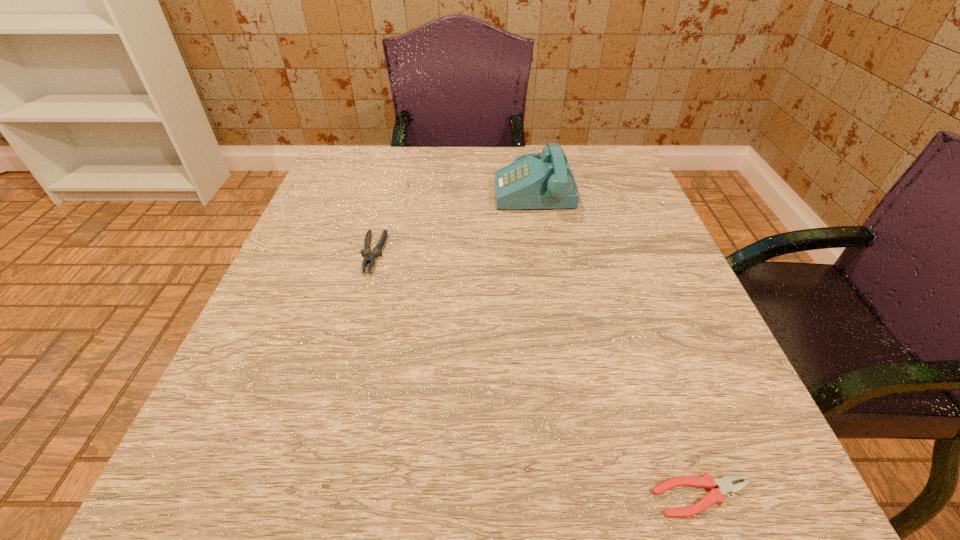
This screenshot has height=540, width=960. What are the coordinates of `telephone` in the screenshot? It's located at click(x=528, y=183).

Where is `the farthest object`? The width and height of the screenshot is (960, 540). the farthest object is located at coordinates (528, 183).

Identify the location of the farther pliers. (370, 257).

Identify the location of the second nearest object. (370, 257).

Identify the location of the nearest object. (724, 485).

You are a GUI agent. You are given a task and a screenshot of the screen. Output one action in this format:
    pyautogui.click(x=<x>, y=<y>)
    Task: Click on the nearer pliers
    The width and height of the screenshot is (960, 540).
    Given the screenshot: What is the action you would take?
    pyautogui.click(x=724, y=485)

The width and height of the screenshot is (960, 540). In order to click on blank area located 0.060m on the dial of the farthest object in this screenshot , I will do `click(468, 185)`.

This screenshot has width=960, height=540. In order to click on blank space located on the dial of the farthest object in this screenshot , I will do `click(413, 185)`.

Identify the location of vacant region located 0.090m on the dial of the farthest object. Image resolution: width=960 pixels, height=540 pixels. (455, 185).

This screenshot has height=540, width=960. I want to click on free space located at the gripping part of the taller pliers, so click(343, 362).